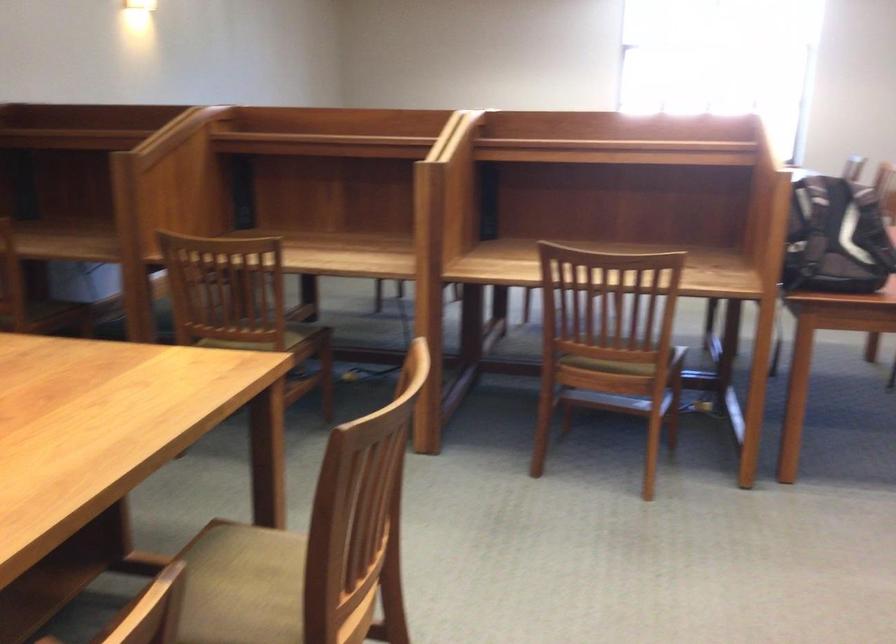
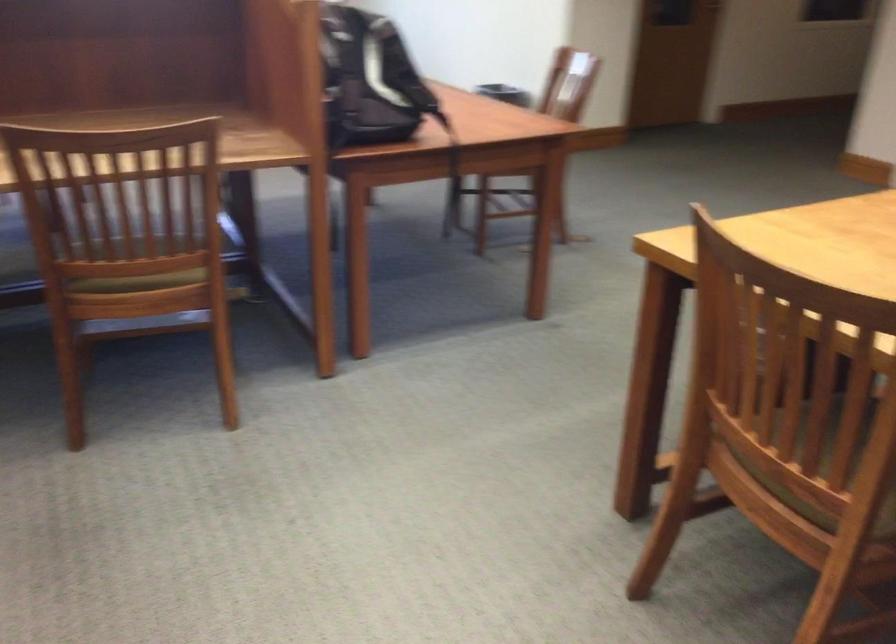
In the second image, find the point that corresponds to point 609,351 in the first image.

(139, 266)